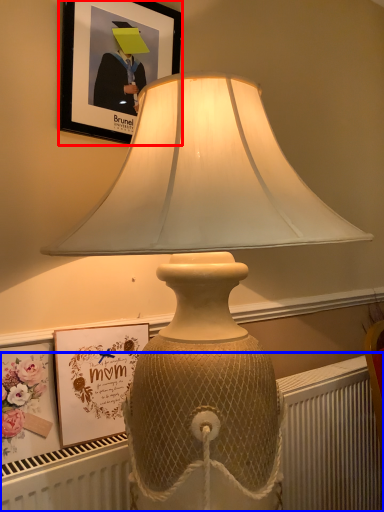
Question: Among these objects, which one is farthest to the camera, picture frame (highlighted by a red box) or radiator (highlighted by a blue box)?

Choices:
 (A) picture frame
 (B) radiator

Answer: (A)